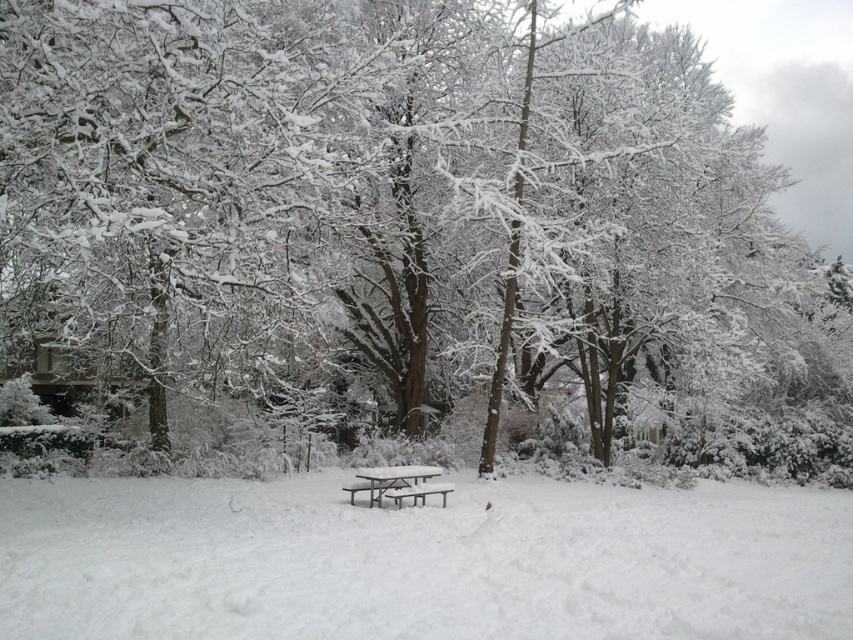
Between white matte snow at center and metallic silver bench at center, which one is positioned higher?

white matte snow at center

Does white matte snow at center appear on the left side of metallic silver bench at center?

Indeed, white matte snow at center is positioned on the left side of metallic silver bench at center.

Does point (729, 632) come in front of point (445, 493)?

Yes, it is in front of point (445, 493).

I want to click on white matte snow at center, so click(421, 561).

Does white plastic picnic table at center lie behind metallic silver bench at center?

Yes, white plastic picnic table at center is behind metallic silver bench at center.

Which is in front, point (445, 483) or point (439, 488)?

Point (439, 488) is in front.

Which is in front, point (396, 496) or point (450, 492)?

Point (396, 496)

Find the location of `white plastic picnic table at center`. white plastic picnic table at center is located at coordinates (397, 483).

How much distance is there between white matte snow at center and white plastic picnic table at center?

white matte snow at center and white plastic picnic table at center are 3.32 meters apart from each other.

Can you confirm if white matte snow at center is wider than white plastic picnic table at center?

Correct, the width of white matte snow at center exceeds that of white plastic picnic table at center.

You are a GUI agent. You are given a task and a screenshot of the screen. Output one action in this format:
    pyautogui.click(x=<x>, y=<y>)
    Task: Click on the white matte snow at center
    This screenshot has width=853, height=640.
    Given the screenshot: What is the action you would take?
    pyautogui.click(x=421, y=561)